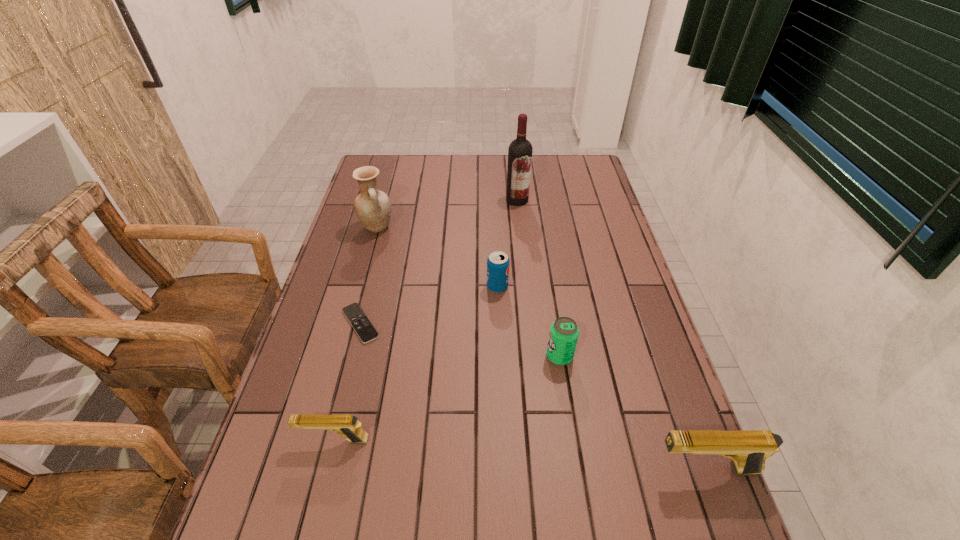
The width and height of the screenshot is (960, 540). In order to click on the left pistol in this screenshot , I will do [347, 425].

This screenshot has width=960, height=540. Identify the location of the farther pistol. (347, 425).

Where is `the right pistol`? the right pistol is located at coordinates (749, 449).

Where is `the rightmost object`? This screenshot has height=540, width=960. the rightmost object is located at coordinates (749, 449).

Where is `wine bottle`? wine bottle is located at coordinates (520, 150).

Where is `the tallest object`? the tallest object is located at coordinates (520, 150).

Image resolution: width=960 pixels, height=540 pixels. I want to click on the sixth shortest object, so click(373, 207).

Identify the location of pottery. The height and width of the screenshot is (540, 960). (373, 207).

Where is `remote control`? This screenshot has height=540, width=960. remote control is located at coordinates (359, 321).

Locate an element on the screen. the shortest object is located at coordinates (359, 321).